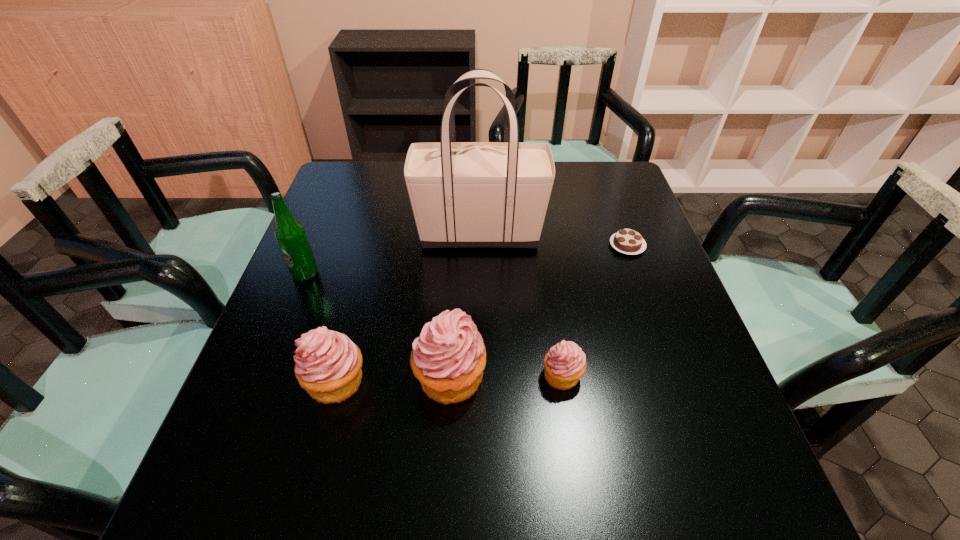
Find the location of a particular element. free location located 0.330m on the back of the fifth object from right to left is located at coordinates (371, 250).

I want to click on vacant point located 0.380m on the back of the second cupcake from right to left, so click(x=458, y=234).

This screenshot has width=960, height=540. What are the coordinates of `free point located 0.130m on the left of the shortest cupcake` in the screenshot? It's located at (477, 375).

Where is `vacant space situated with handles facing forward on the tallest object`? The width and height of the screenshot is (960, 540). vacant space situated with handles facing forward on the tallest object is located at coordinates (644, 233).

Locate an element on the screen. This screenshot has height=540, width=960. vacant space located 0.070m on the front of the rightmost object is located at coordinates (638, 276).

Where is `free spot located on the label of the fifth shortest object`? This screenshot has width=960, height=540. free spot located on the label of the fifth shortest object is located at coordinates (292, 308).

Identify the location of cupcake that is at the left edge. (328, 365).

Locate an element on the screen. This screenshot has height=540, width=960. beer bottle that is positioned at the left edge is located at coordinates (290, 234).

Identify the location of object present at the right edge. Image resolution: width=960 pixels, height=540 pixels. (627, 241).

The image size is (960, 540). What are the coordinates of `object located at the near left corner` in the screenshot? It's located at (328, 365).